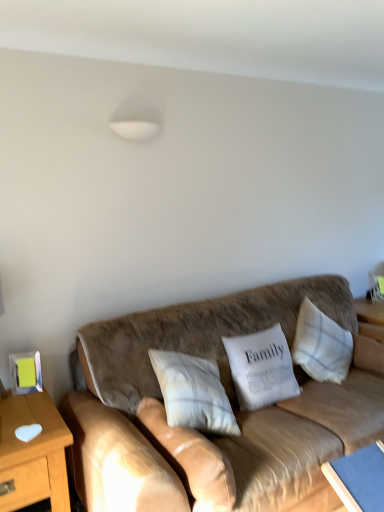
What do you see at coordinates (321, 345) in the screenshot? The height and width of the screenshot is (512, 384). I see `white textured pillow at right, the fourth pillow when ordered from left to right` at bounding box center [321, 345].

Locate an element on the screen. Image resolution: width=384 pixels, height=512 pixels. white cotton pillow at center, arranged as the second pillow when viewed from the left is located at coordinates (193, 393).

What do you see at coordinates (193, 393) in the screenshot? I see `white cotton pillow at center, which is counted as the 3th pillow, starting from the right` at bounding box center [193, 393].

Describe the element at coordinates (33, 453) in the screenshot. I see `wooden table at left, the 2th table when ordered from right to left` at that location.

In order to face blue fabric table at lower right, the first table viewed from the right, should I rotate leftwards or rightwards?

You should rotate right by 23.851 degrees.

Describe the element at coordinates (230, 402) in the screenshot. I see `brown leather couch at center` at that location.

Image resolution: width=384 pixels, height=512 pixels. I want to click on white textured pillow at center, arranged as the 1th pillow when viewed from the left, so click(x=189, y=457).

Is point (345, 425) farther from viewer compared to point (154, 371)?

No.

Is brown leather couch at center located outside white cotton pillow at center, which is counted as the 3th pillow, starting from the right?

That's correct, brown leather couch at center is outside of white cotton pillow at center, which is counted as the 3th pillow, starting from the right.

Can you see brown leather couch at center touching white cotton pillow at center, which is counted as the 3th pillow, starting from the right?

No, brown leather couch at center is not beside white cotton pillow at center, which is counted as the 3th pillow, starting from the right.

In the scene shown: Which is more to the right, brown leather couch at center or white cotton pillow at center, which is counted as the 3th pillow, starting from the right?

From the viewer's perspective, brown leather couch at center appears more on the right side.

How many degrees apart are the facing directions of white textured pillow at right, which is the 1th pillow in right-to-left order, and blue fabric table at lower right, the second table from the left?

There is a 1.25-degree angle between the facing directions of white textured pillow at right, which is the 1th pillow in right-to-left order, and blue fabric table at lower right, the second table from the left.

From the picture: Is white textured pillow at right, which is the 1th pillow in right-to-left order, thinner than blue fabric table at lower right, the first table viewed from the right?

Indeed, white textured pillow at right, which is the 1th pillow in right-to-left order, has a lesser width compared to blue fabric table at lower right, the first table viewed from the right.

Are white textured pillow at right, which is the 1th pillow in right-to-left order, and blue fabric table at lower right, the second table from the left, far apart?

No.

From their relative heights in the image, would you say white textured pillow at right, the fourth pillow when ordered from left to right, is taller or shorter than blue fabric table at lower right, the second table from the left?

Considering their sizes, white textured pillow at right, the fourth pillow when ordered from left to right, has more height than blue fabric table at lower right, the second table from the left.

Is white fabric pillow at center, which ranks as the 2th pillow in right-to-left order, inside wooden table at left, the first table when ordered from left to right?

No.

Relative to white fabric pillow at center, which ranks as the 2th pillow in right-to-left order, is wooden table at left, the 2th table when ordered from right to left, in front or behind?

Visually, wooden table at left, the 2th table when ordered from right to left, is located in front of white fabric pillow at center, which ranks as the 2th pillow in right-to-left order.

Between wooden table at left, the first table when ordered from left to right, and white fabric pillow at center, arranged as the third pillow when viewed from the left, which one has more height?

With more height is wooden table at left, the first table when ordered from left to right.

Which is more to the left, brown leather couch at center or white textured pillow at center, arranged as the 1th pillow when viewed from the left?

white textured pillow at center, arranged as the 1th pillow when viewed from the left.

From the image's perspective, relative to white textured pillow at center, which is the 4th pillow in right-to-left order, is brown leather couch at center above or below?

Clearly, from the image's perspective, brown leather couch at center is above white textured pillow at center, which is the 4th pillow in right-to-left order.

Would you consider brown leather couch at center to be distant from white textured pillow at center, arranged as the 1th pillow when viewed from the left?

No.

Choose the correct answer: Is brown leather couch at center inside white textured pillow at center, arranged as the 1th pillow when viewed from the left, or outside it?

brown leather couch at center is spatially situated outside white textured pillow at center, arranged as the 1th pillow when viewed from the left.

I want to click on pillow lying behind the white fabric pillow at center, which ranks as the 2th pillow in right-to-left order, so click(321, 345).

Is white textured pillow at right, which is the 1th pillow in right-to-left order, at the back of white fabric pillow at center, which ranks as the 2th pillow in right-to-left order?

That's not correct — white fabric pillow at center, which ranks as the 2th pillow in right-to-left order, is not looking away from white textured pillow at right, which is the 1th pillow in right-to-left order.

Considering the relative positions of white fabric pillow at center, which ranks as the 2th pillow in right-to-left order, and white textured pillow at right, the fourth pillow when ordered from left to right, in the image provided, is white fabric pillow at center, which ranks as the 2th pillow in right-to-left order, to the right of white textured pillow at right, the fourth pillow when ordered from left to right, from the viewer's perspective?

No, white fabric pillow at center, which ranks as the 2th pillow in right-to-left order, is not to the right of white textured pillow at right, the fourth pillow when ordered from left to right.

Is white fabric pillow at center, which ranks as the 2th pillow in right-to-left order, not near white textured pillow at right, which is the 1th pillow in right-to-left order?

No, white fabric pillow at center, which ranks as the 2th pillow in right-to-left order, is in close proximity to white textured pillow at right, which is the 1th pillow in right-to-left order.

From the white cotton pillow at center, which is counted as the 3th pillow, starting from the right, count 2nd pillows backward and point to it. Please provide its 2D coordinates.

[(321, 345)]

From a real-world perspective, relative to white cotton pillow at center, arranged as the second pillow when viewed from the left, is white textured pillow at right, the fourth pillow when ordered from left to right, vertically above or below?

In terms of real-world spatial position, white textured pillow at right, the fourth pillow when ordered from left to right, is above white cotton pillow at center, arranged as the second pillow when viewed from the left.

Could you tell me if white textured pillow at right, the fourth pillow when ordered from left to right, is facing white cotton pillow at center, which is counted as the 3th pillow, starting from the right?

No, white textured pillow at right, the fourth pillow when ordered from left to right, does not turn towards white cotton pillow at center, which is counted as the 3th pillow, starting from the right.

Can you confirm if white textured pillow at right, which is the 1th pillow in right-to-left order, is positioned to the right of white cotton pillow at center, arranged as the second pillow when viewed from the left?

Yes.

Does blue fabric table at lower right, the second table from the left, have a greater height compared to white fabric pillow at center, which ranks as the 2th pillow in right-to-left order?

Yes.

From a real-world perspective, is blue fabric table at lower right, the first table viewed from the right, beneath white fabric pillow at center, arranged as the third pillow when viewed from the left?

Yes.

Which point is more distant from viewer, (371, 460) or (275, 381)?

The point (275, 381) is farther.

Where is `studio couch below the white cotton pillow at center, arranged as the second pillow when viewed from the left (from the image's perspective)`? Image resolution: width=384 pixels, height=512 pixels. studio couch below the white cotton pillow at center, arranged as the second pillow when viewed from the left (from the image's perspective) is located at coordinates tap(230, 402).

At what (x,y) coordinates should I click in order to perform the action: click on the 3rd pillow behind when counting from the blue fabric table at lower right, the second table from the left. Please return your answer as a coordinate pair (x, y). Looking at the image, I should click on (321, 345).

Which object lies nearer to the anchor point white cotton pillow at center, which is counted as the 3th pillow, starting from the right, wooden table at left, the 2th table when ordered from right to left, or blue fabric table at lower right, the second table from the left?

wooden table at left, the 2th table when ordered from right to left, lies closer to white cotton pillow at center, which is counted as the 3th pillow, starting from the right, than the other object.

Which object lies further to the anchor point wooden table at left, the first table when ordered from left to right, white cotton pillow at center, arranged as the second pillow when viewed from the left, or blue fabric table at lower right, the first table viewed from the right?

blue fabric table at lower right, the first table viewed from the right, is positioned further to the anchor wooden table at left, the first table when ordered from left to right.

Looking at the image, which one is located closer to wooden table at left, the first table when ordered from left to right, white textured pillow at right, the fourth pillow when ordered from left to right, or white cotton pillow at center, which is counted as the 3th pillow, starting from the right?

white cotton pillow at center, which is counted as the 3th pillow, starting from the right.

From the image, which object appears to be nearer to white textured pillow at center, arranged as the 1th pillow when viewed from the left, white cotton pillow at center, which is counted as the 3th pillow, starting from the right, or white fabric pillow at center, which ranks as the 2th pillow in right-to-left order?

Among the two, white cotton pillow at center, which is counted as the 3th pillow, starting from the right, is located nearer to white textured pillow at center, arranged as the 1th pillow when viewed from the left.

Looking at the image, which one is located further to white fabric pillow at center, which ranks as the 2th pillow in right-to-left order, white textured pillow at center, arranged as the 1th pillow when viewed from the left, or blue fabric table at lower right, the second table from the left?

white textured pillow at center, arranged as the 1th pillow when viewed from the left, is positioned further to the anchor white fabric pillow at center, which ranks as the 2th pillow in right-to-left order.

Estimate the real-world distances between objects in this image. Which object is closer to white cotton pillow at center, which is counted as the 3th pillow, starting from the right, wooden table at left, the first table when ordered from left to right, or white fabric pillow at center, arranged as the third pillow when viewed from the left?

white fabric pillow at center, arranged as the third pillow when viewed from the left, is closer to white cotton pillow at center, which is counted as the 3th pillow, starting from the right.

When comparing their distances from white textured pillow at right, the fourth pillow when ordered from left to right, does white cotton pillow at center, arranged as the second pillow when viewed from the left, or brown leather couch at center seem closer?

brown leather couch at center lies closer to white textured pillow at right, the fourth pillow when ordered from left to right, than the other object.

Which object lies further to the anchor point wooden table at left, the 2th table when ordered from right to left, blue fabric table at lower right, the first table viewed from the right, or white textured pillow at right, the fourth pillow when ordered from left to right?

white textured pillow at right, the fourth pillow when ordered from left to right, lies further to wooden table at left, the 2th table when ordered from right to left, than the other object.

Image resolution: width=384 pixels, height=512 pixels. What are the coordinates of `pillow between white cotton pillow at center, arranged as the second pillow when viewed from the left, and blue fabric table at lower right, the first table viewed from the right` in the screenshot? It's located at (261, 368).

The width and height of the screenshot is (384, 512). In order to click on pillow between wooden table at left, the 2th table when ordered from right to left, and white cotton pillow at center, arranged as the second pillow when viewed from the left, in the horizontal direction in this screenshot , I will do `click(189, 457)`.

Find the location of a particular element. studio couch situated between white cotton pillow at center, which is counted as the 3th pillow, starting from the right, and blue fabric table at lower right, the second table from the left, from left to right is located at coordinates click(x=230, y=402).

Locate an element on the screen. The width and height of the screenshot is (384, 512). studio couch situated between white textured pillow at center, which is the 4th pillow in right-to-left order, and blue fabric table at lower right, the second table from the left, from left to right is located at coordinates (230, 402).